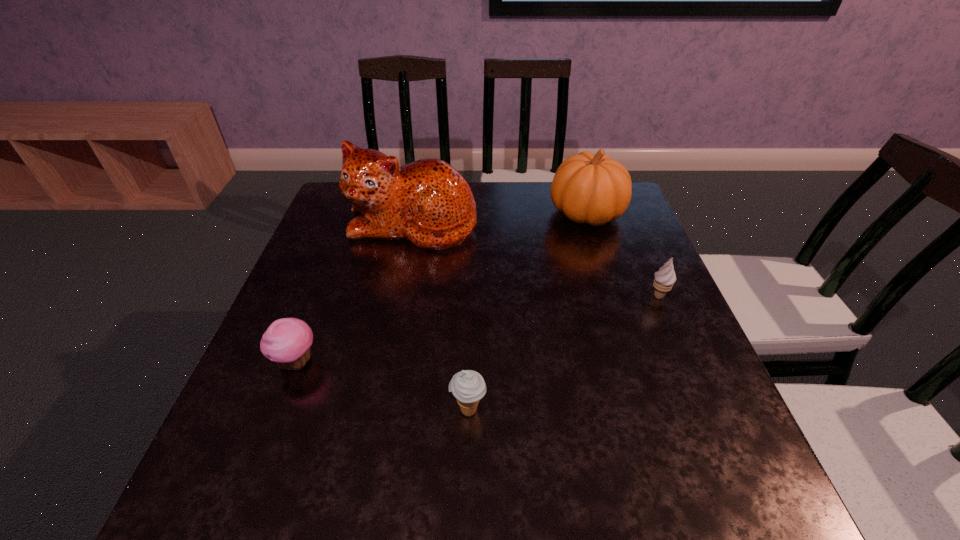
This screenshot has width=960, height=540. I want to click on cat, so click(x=428, y=202).

The width and height of the screenshot is (960, 540). I want to click on pumpkin, so click(x=590, y=188).

This screenshot has height=540, width=960. In order to click on the third farthest object in this screenshot , I will do `click(664, 279)`.

I want to click on the right icecream, so [664, 279].

Find the location of a particular element. The height and width of the screenshot is (540, 960). the nearer icecream is located at coordinates (468, 387).

The height and width of the screenshot is (540, 960). In order to click on the left icecream in this screenshot , I will do `click(468, 387)`.

Find the location of `the second nearest object`. the second nearest object is located at coordinates (287, 341).

Identify the location of vacant space located on the face of the cat. (398, 297).

At what (x,y) coordinates should I click in order to perform the action: click on free region located 0.240m on the left of the fourth shortest object. Please return your answer as a coordinate pair (x, y). This screenshot has height=540, width=960. Looking at the image, I should click on (466, 213).

Find the location of a particular element. Image resolution: width=960 pixels, height=540 pixels. vacant space located 0.240m on the front-facing side of the right icecream is located at coordinates (701, 393).